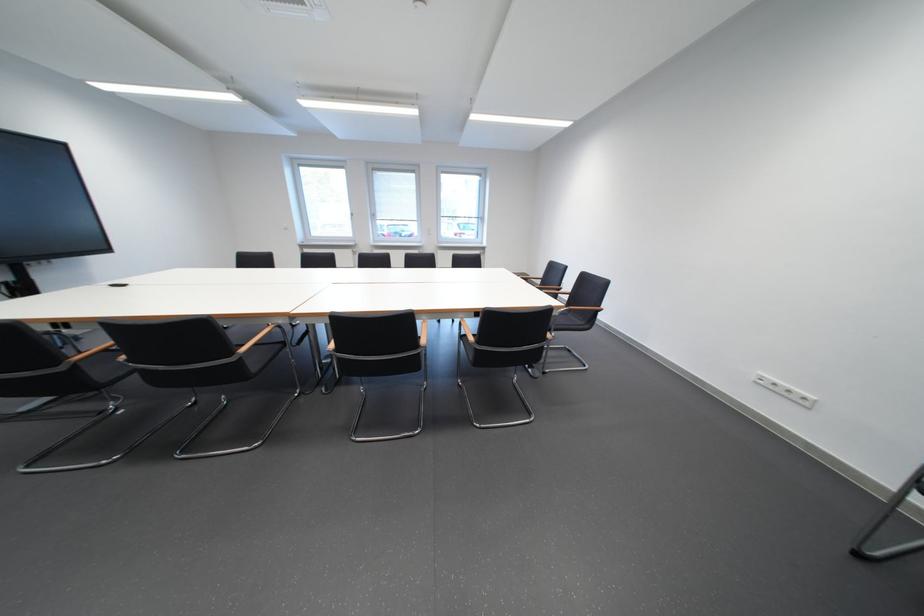
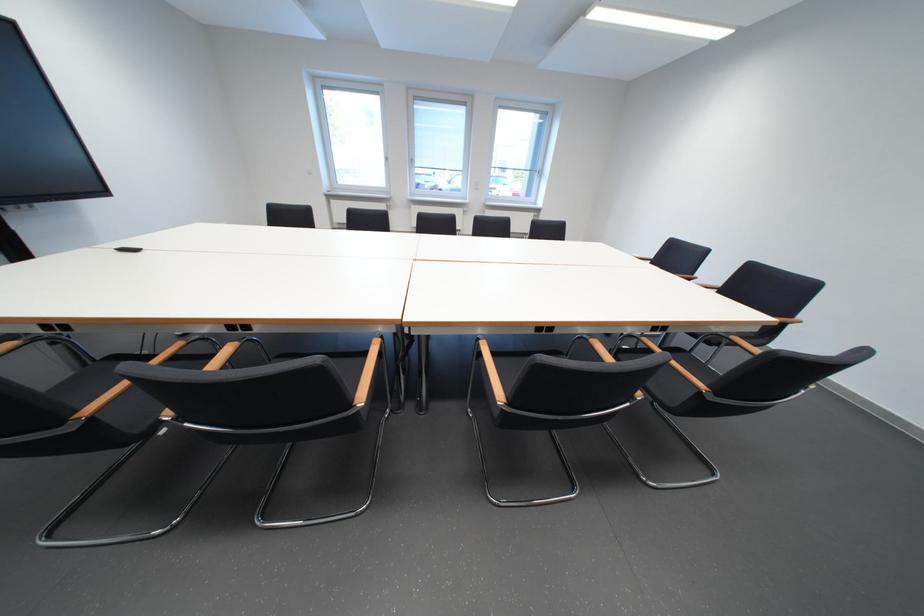
From the picture: Which direction would the cameraman need to move to produce the second image?

The movement direction of the cameraman is left, forward.